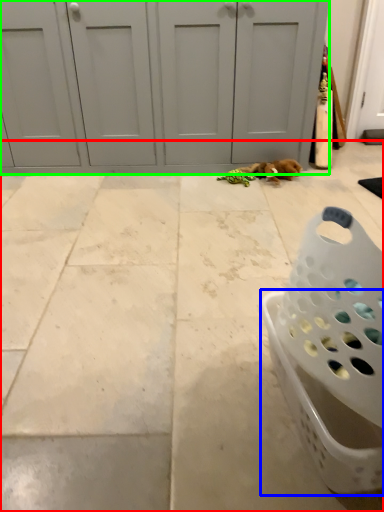
Question: Which object is positioned farthest from concrete (highlighted by a red box)? Select from basket (highlighted by a blue box) and door (highlighted by a green box).

Choices:
 (A) basket
 (B) door

Answer: (B)